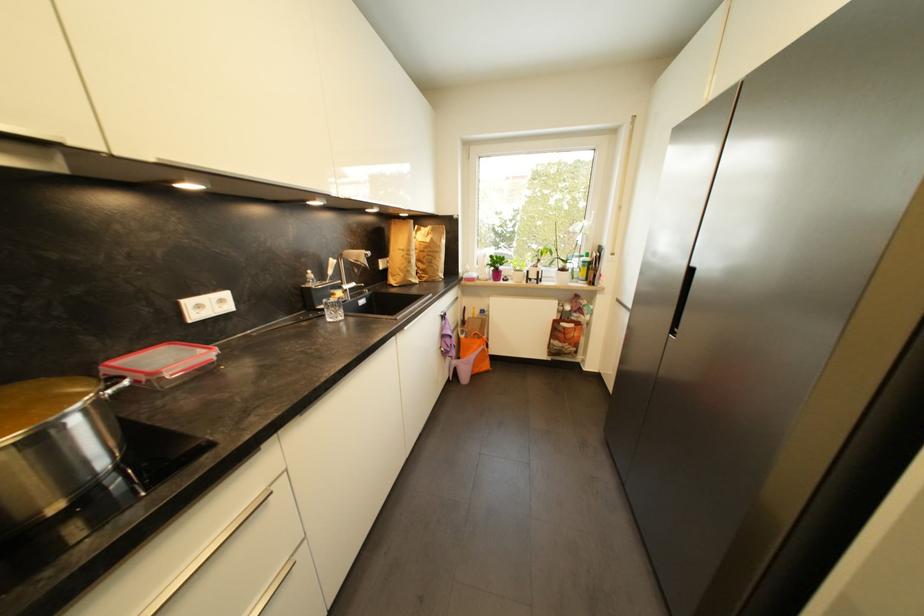
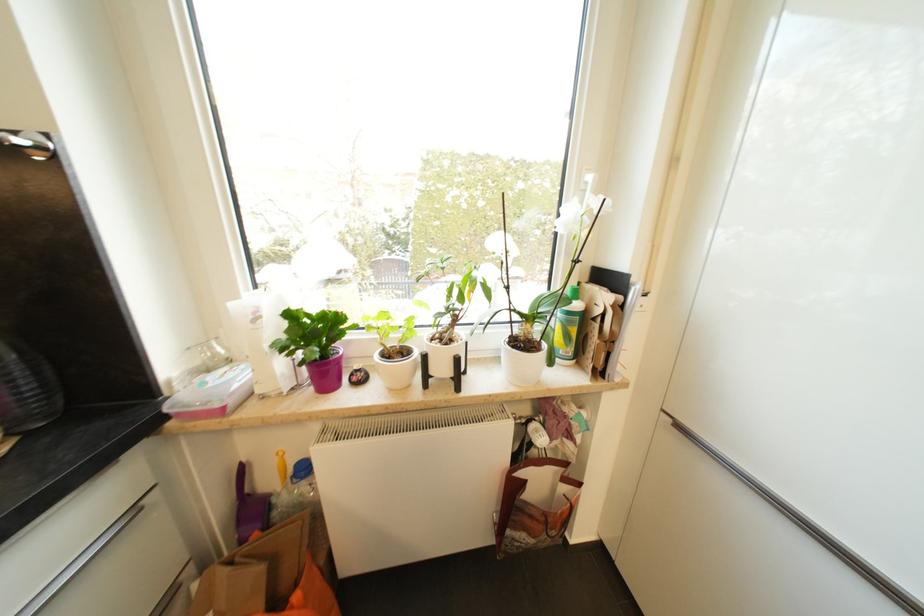
Find the pixel in the second image that matches (589,264) in the first image.

(574, 315)